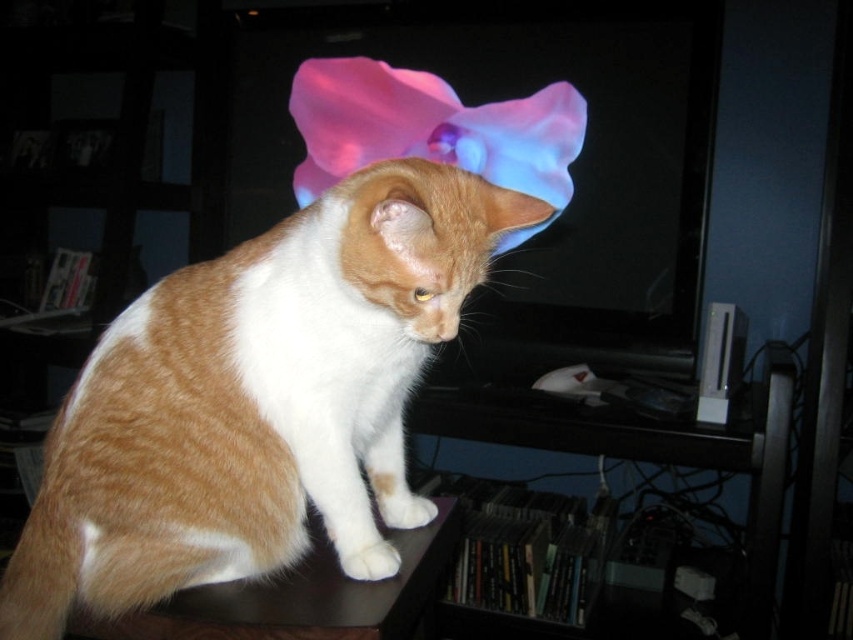
Which is below, orange-white fur cat at center or brown wooden table at lower left?

brown wooden table at lower left is below.

Does orange-white fur cat at center have a greater width compared to brown wooden table at lower left?

Yes, orange-white fur cat at center is wider than brown wooden table at lower left.

Does point (107, 573) lie in front of point (186, 625)?

No.

The image size is (853, 640). In order to click on orange-white fur cat at center in this screenshot , I will do `click(257, 401)`.

Describe the element at coordinates (257, 401) in the screenshot. I see `orange-white fur cat at center` at that location.

Can you confirm if orange-white fur cat at center is thinner than orange fur cat at center?

No, orange-white fur cat at center is not thinner than orange fur cat at center.

Which is in front, point (407, 179) or point (520, 220)?

Point (407, 179) is more forward.

The height and width of the screenshot is (640, 853). Find the location of `orange-white fur cat at center`. orange-white fur cat at center is located at coordinates (257, 401).

What are the coordinates of `orange fur cat at center` in the screenshot? It's located at (424, 237).

Between point (402, 282) and point (241, 636), which one is positioned behind?

Point (402, 282)

The width and height of the screenshot is (853, 640). What are the coordinates of `orange fur cat at center` in the screenshot? It's located at (424, 237).